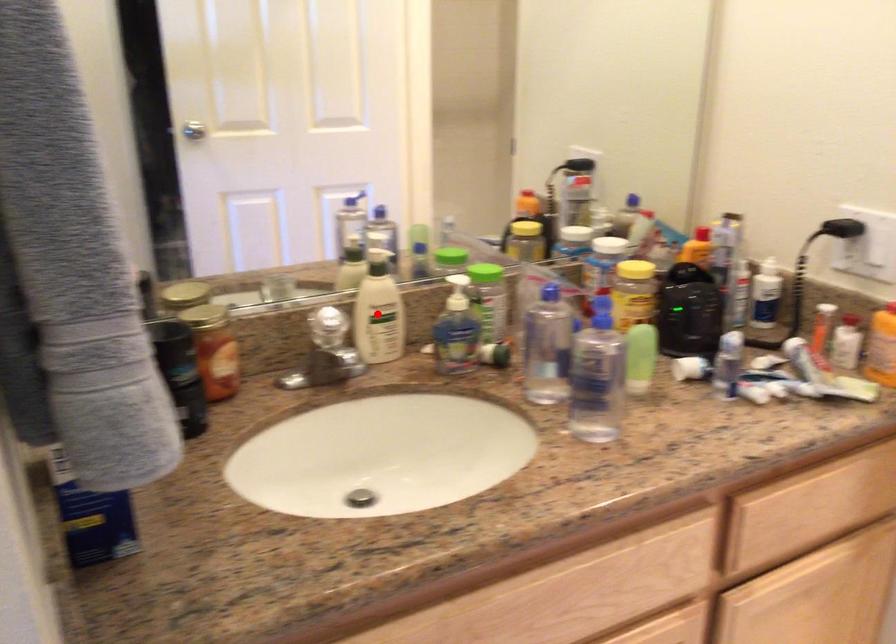
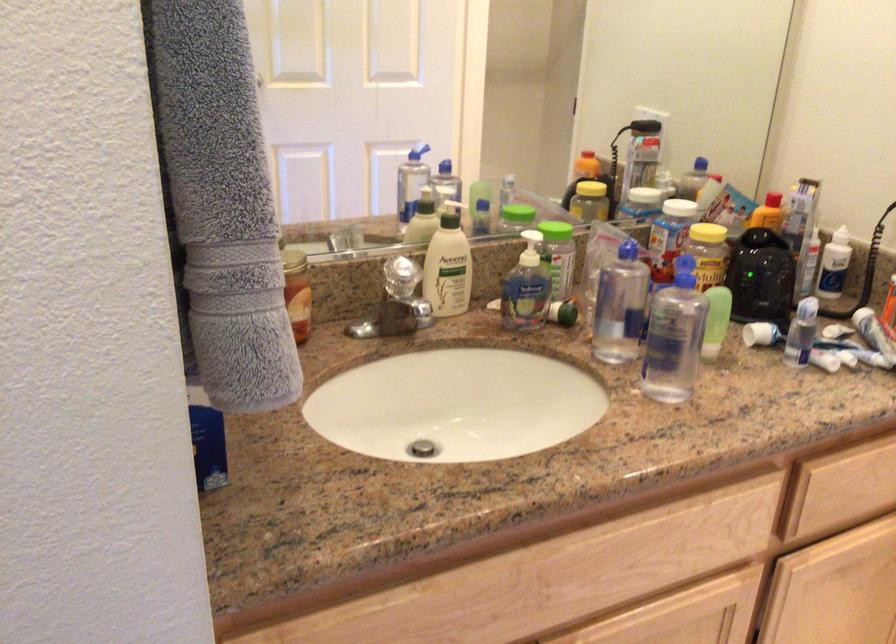
Find the pixel in the second image that matches the highlighted location in the first image.

(448, 265)